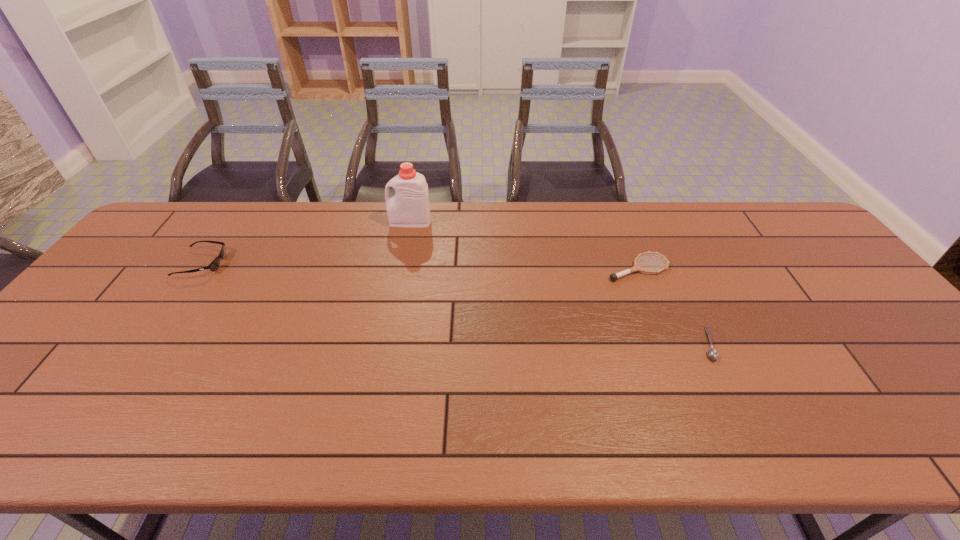
Identify the location of the tallest object. (410, 208).

Where is `the farthest object`? The image size is (960, 540). the farthest object is located at coordinates (410, 208).

Find the location of `sunglasses`. sunglasses is located at coordinates (213, 266).

What are the coordinates of `the second tallest object` in the screenshot? It's located at (213, 266).

This screenshot has width=960, height=540. Find the location of `the third tallest object`. the third tallest object is located at coordinates (636, 267).

What are the coordinates of `the nearest object` in the screenshot? It's located at (712, 353).

Identify the location of the shortest object. The height and width of the screenshot is (540, 960). point(712,353).

The width and height of the screenshot is (960, 540). I want to click on free location located 0.260m on the handle side of the third object from right to left, so click(310, 222).

This screenshot has width=960, height=540. Find the location of `vacant point located 0.340m on the handle side of the third object from right to left`. vacant point located 0.340m on the handle side of the third object from right to left is located at coordinates (286, 222).

I want to click on free location located 0.180m on the handle side of the third object from right to left, so click(x=335, y=222).